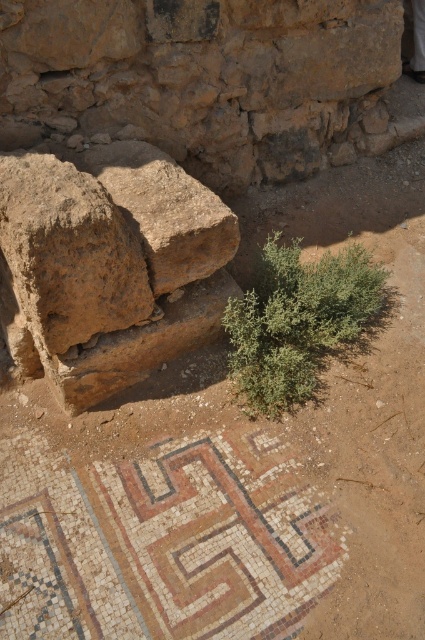
Question: Which of the following is the farthest from the observer?

Choices:
 (A) (113, 298)
 (B) (138, 168)

Answer: (B)

Question: Considering the relative positions of brown rough rock at left and brown rough rock at upper left in the image provided, where is brown rough rock at left located with respect to brown rough rock at upper left?

Choices:
 (A) above
 (B) below

Answer: (B)

Question: From the image, what is the correct spatial relationship of brown rough rock at left in relation to brown rough rock at upper left?

Choices:
 (A) above
 (B) below

Answer: (B)

Question: Is brown rough rock at left positioned before brown rough rock at upper left?

Choices:
 (A) yes
 (B) no

Answer: (A)